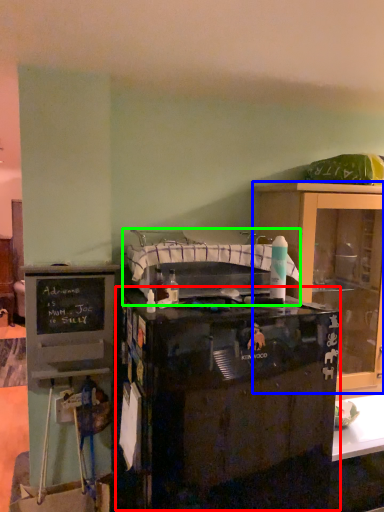
Question: Considering the real-world distances, which object is farthest from desk (highlighted by a red box)? cabinetry (highlighted by a blue box) or sink (highlighted by a green box)?

Choices:
 (A) cabinetry
 (B) sink

Answer: (A)